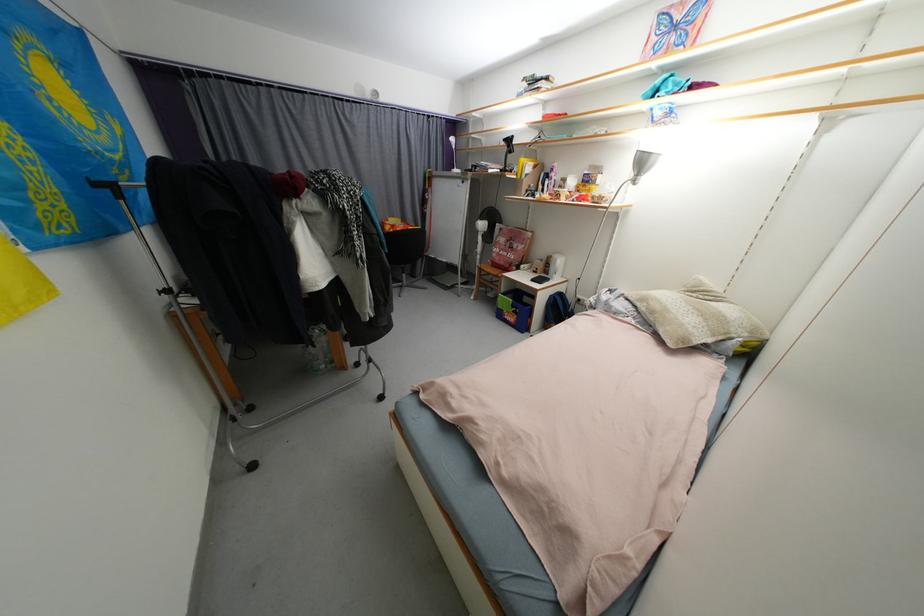
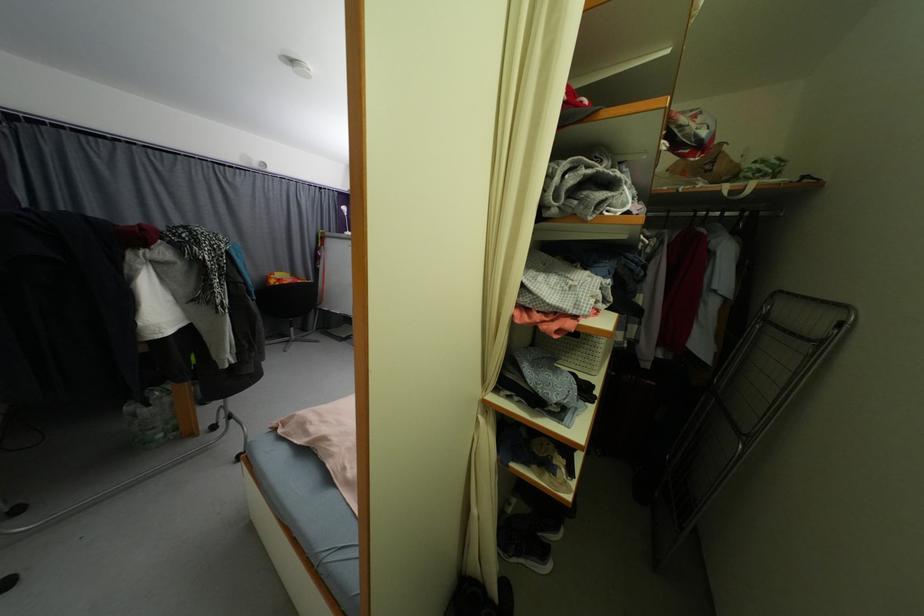
The point at (320, 347) is marked in the first image. Where is the corresponding point in the second image?

(154, 407)